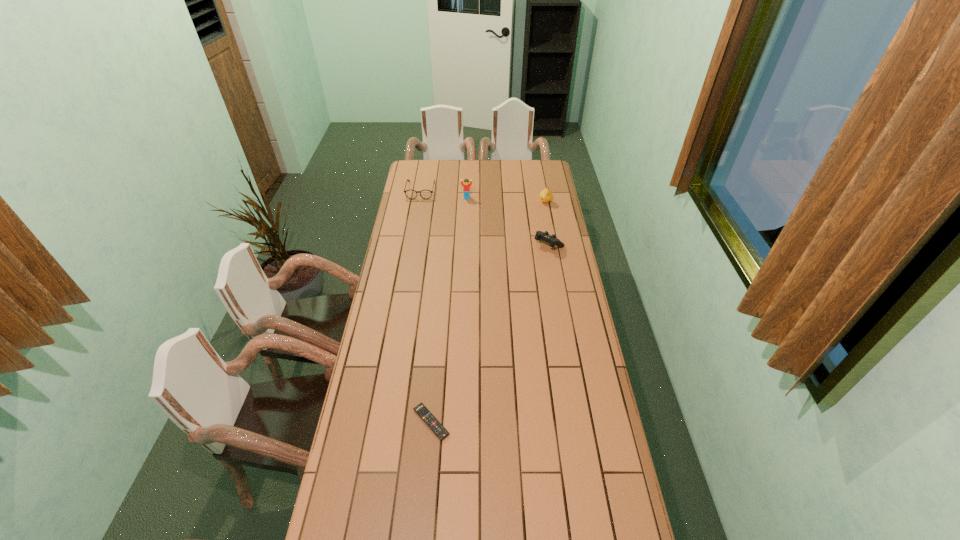
Locate an element on the screen. The width and height of the screenshot is (960, 540). vacant space that satisfies the following two spatial constraints: 1. on the front-facing side of the leftmost object; 2. on the right side of the remote control is located at coordinates (380, 422).

You are a GUI agent. You are given a task and a screenshot of the screen. Output one action in this format:
    pyautogui.click(x=<x>, y=<y>)
    Task: Click on the vacant area that satisfies the following two spatial constraints: 1. on the face of the Lego; 2. on the right side of the control
    This screenshot has height=540, width=960.
    Given the screenshot: What is the action you would take?
    pyautogui.click(x=465, y=245)

The image size is (960, 540). In order to click on free space in the image that satisfies the following two spatial constraints: 1. on the back side of the nearest object; 2. on the right side of the second tallest object in this screenshot , I will do `click(450, 202)`.

Identify the location of free spot that satisfies the following two spatial constraints: 1. on the front-facing side of the pear; 2. on the right side of the leftmost object. The height and width of the screenshot is (540, 960). (419, 202).